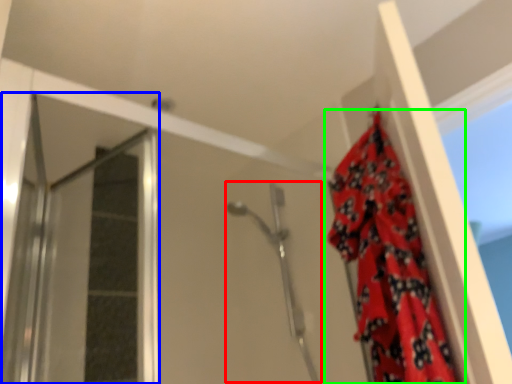
Question: Which object is positioned closest to shower (highlighted by a red box)? Select from screen door (highlighted by a blue box) and curtain (highlighted by a green box).

Choices:
 (A) screen door
 (B) curtain

Answer: (B)